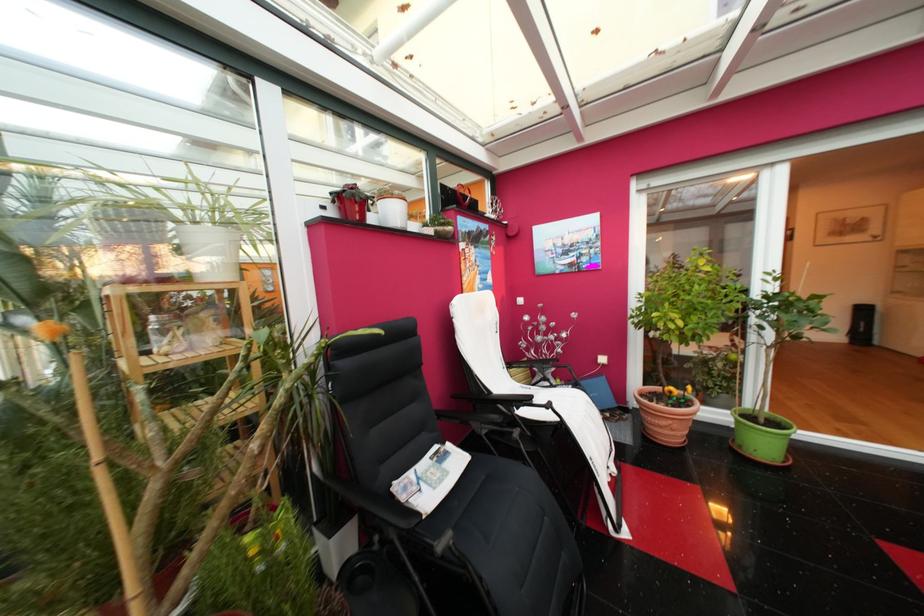
Locate an element on the screen. The image size is (924, 616). glass jar is located at coordinates (165, 333).